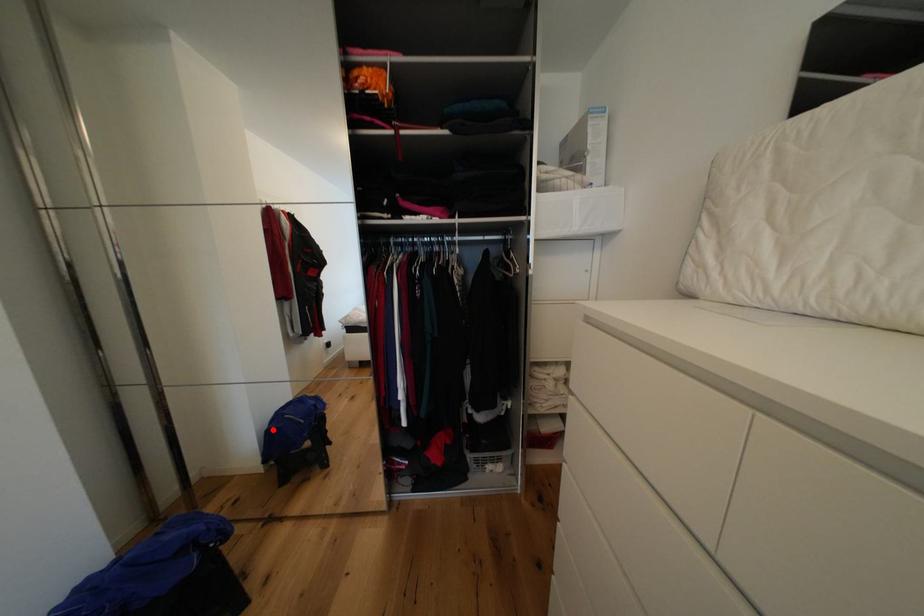
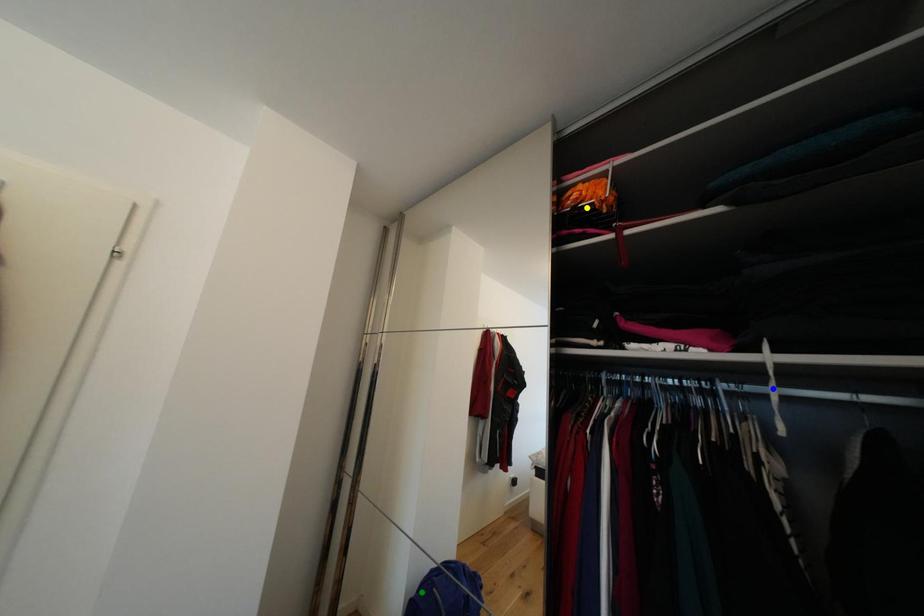
Question: I am providing you with two images of the same scene from different viewpoints. A red point is marked on the first image. You are given multiple points on the second image. Which point in image 2 represents the same 3d spot as the red point in image 1?

Choices:
 (A) blue point
 (B) yellow point
 (C) green point

Answer: (C)